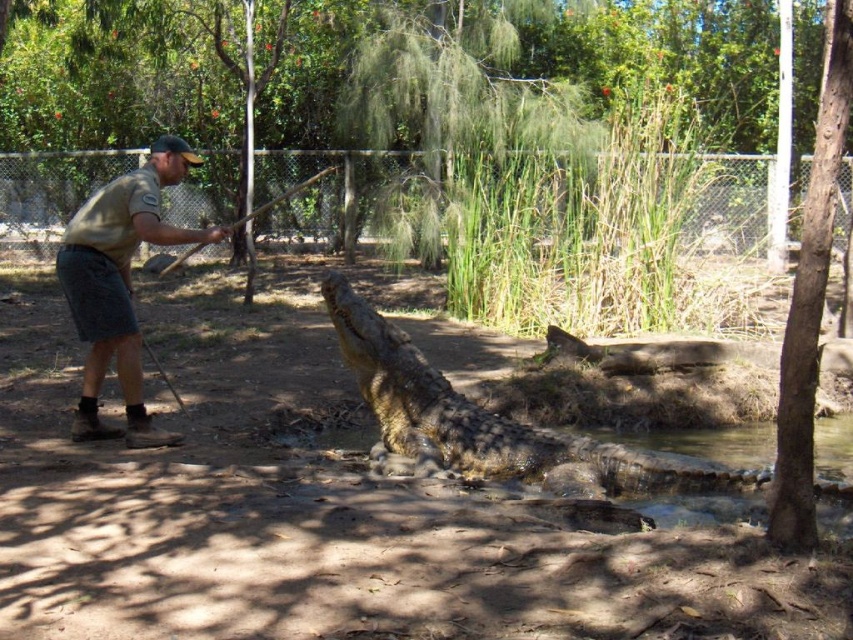
Can you confirm if leathery brown crocodile at center is smaller than khaki uniform at left?

Incorrect, leathery brown crocodile at center is not smaller in size than khaki uniform at left.

Image resolution: width=853 pixels, height=640 pixels. Identify the location of leathery brown crocodile at center. (490, 420).

Find the location of `leathery brown crocodile at center`. leathery brown crocodile at center is located at coordinates (490, 420).